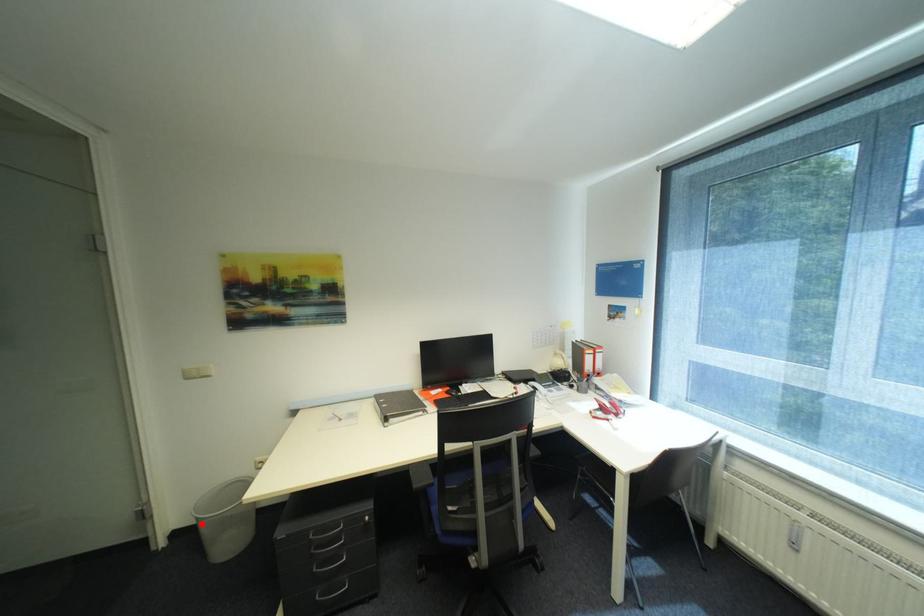
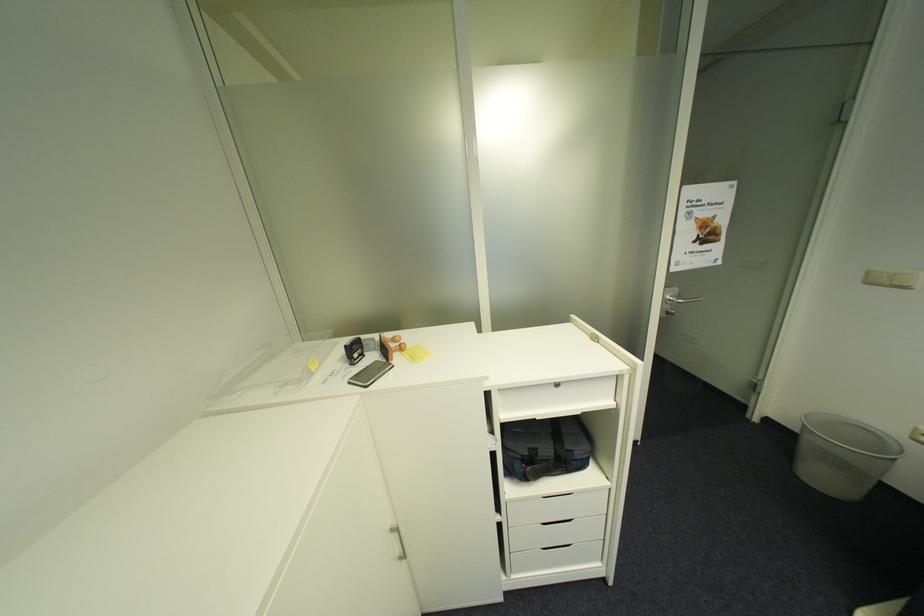
Question: I am providing you with two images of the same scene from different viewpoints. Image1 has a red point marked. In image2, the corresponding 3D location appears at what relative position? Reply with the corresponding letter.

Choices:
 (A) Closer
 (B) Farther

Answer: (B)